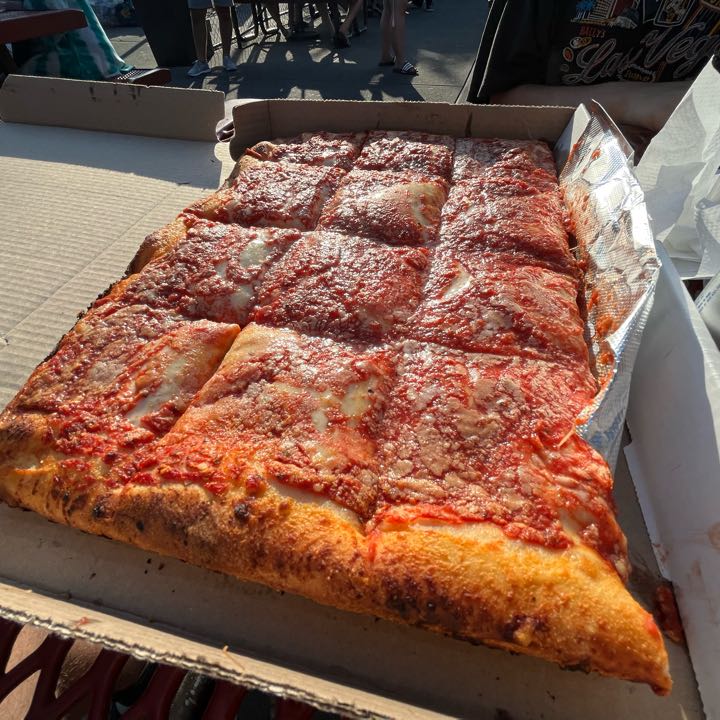
Where is `crumpled napkin`? This screenshot has height=720, width=720. crumpled napkin is located at coordinates (683, 150).